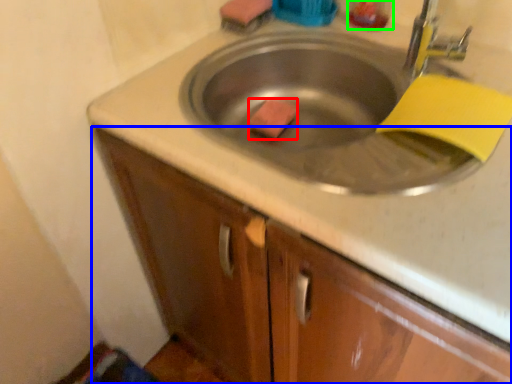
Question: Which object is the closest to the soap (highlighted by a red box)? Choose among these: cabinetry (highlighted by a blue box) or liquid (highlighted by a green box).

Choices:
 (A) cabinetry
 (B) liquid

Answer: (B)